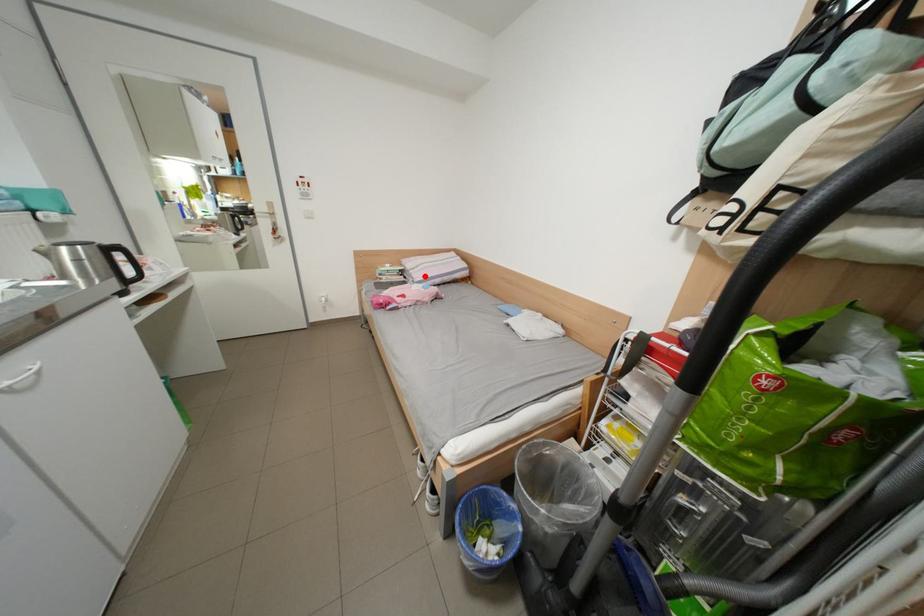
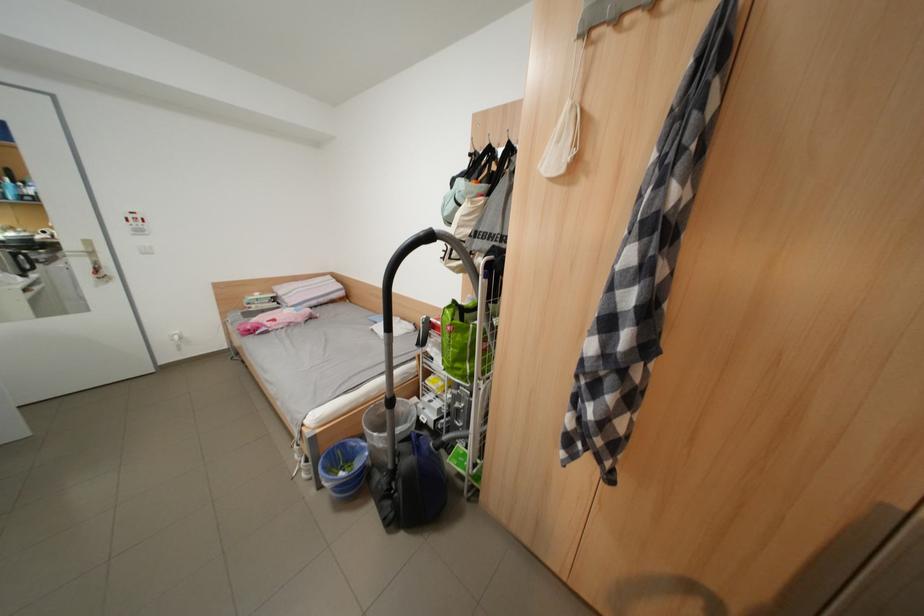
Where in the second image is the point corresponding to the highlighted location from the first image?

(298, 302)